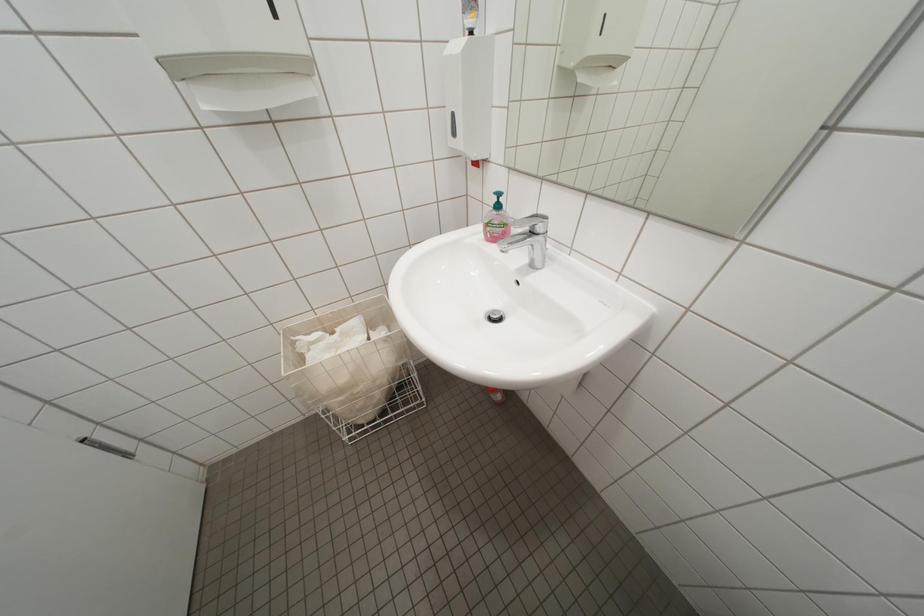
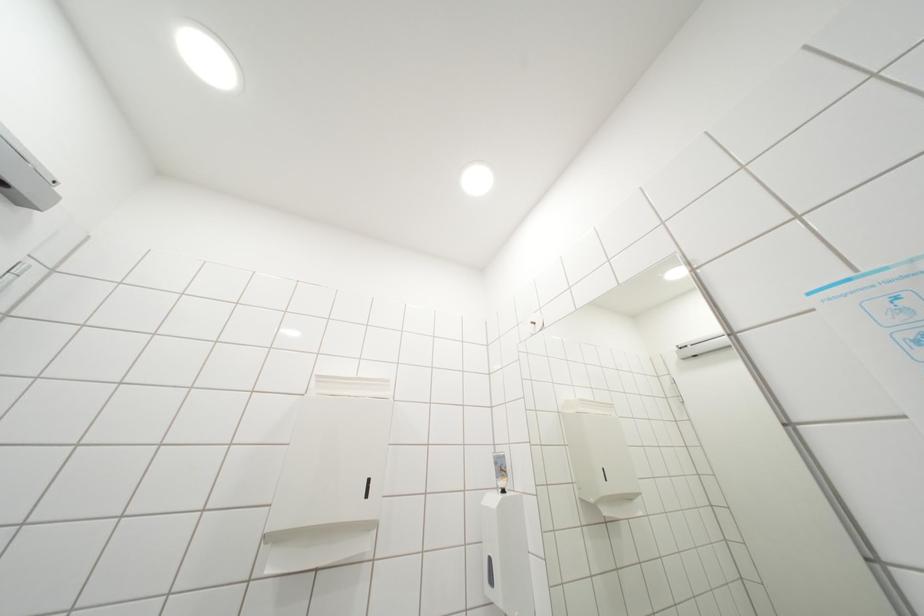
How did the camera likely rotate?

The camera rotated toward left-up.